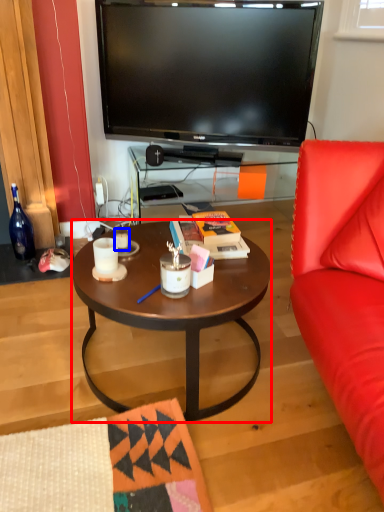
Question: Which point is closer to the camera, coffee table (highlighted by a red box) or coffee cup (highlighted by a blue box)?

Choices:
 (A) coffee table
 (B) coffee cup

Answer: (A)